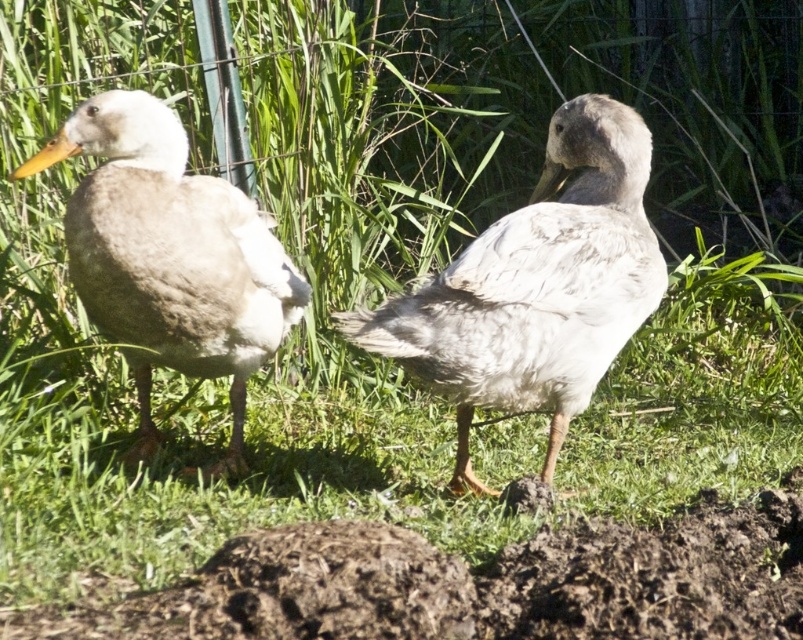
Image resolution: width=803 pixels, height=640 pixels. In order to click on brown earthy mud at lower center in this screenshot , I will do `click(479, 582)`.

Is the position of white fluffy duck at center less distant than that of white matte duck at left?

That is False.

Who is shorter, white fluffy duck at center or white matte duck at left?

Standing shorter between the two is white matte duck at left.

Which is in front, point (397, 353) or point (215, 202)?

Point (397, 353) is more forward.

Identify the location of white fluffy duck at center. (536, 288).

Does brown earthy mud at lower center have a smaller size compared to white matte duck at left?

Yes, brown earthy mud at lower center is smaller than white matte duck at left.

Which is in front, point (716, 534) or point (135, 106)?

Point (716, 534)

Locate an element on the screen. Image resolution: width=803 pixels, height=640 pixels. brown earthy mud at lower center is located at coordinates (479, 582).